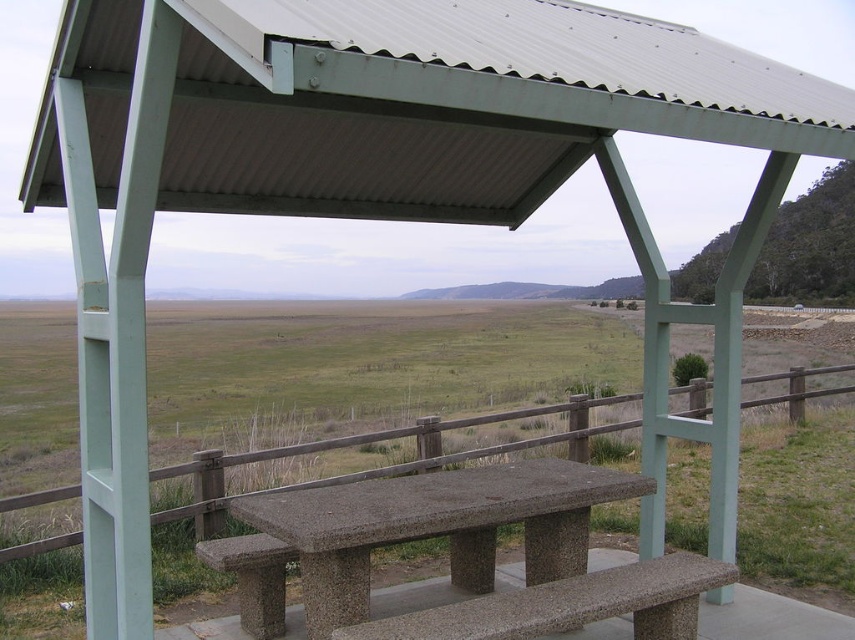
You are planning to place a large potted plant between the granite bench at center and the granite bench at lower center. Based on their positions, where should you place the plant to ensure it is between both benches?

The granite bench at center is positioned over the granite bench at lower center, so placing the plant directly below the granite bench at center would place it between both benches.

You are planning to set up a picnic blanket between the concrete bench at center and the brown wooden fence at center. The picnic blanket is 3 meters long. Will there be enough space between them to fully spread out the blanket?

The concrete bench at center and brown wooden fence at center are 3.57 meters apart. Since the picnic blanket is 3 meters long, there will be enough space to fully spread it out between them.